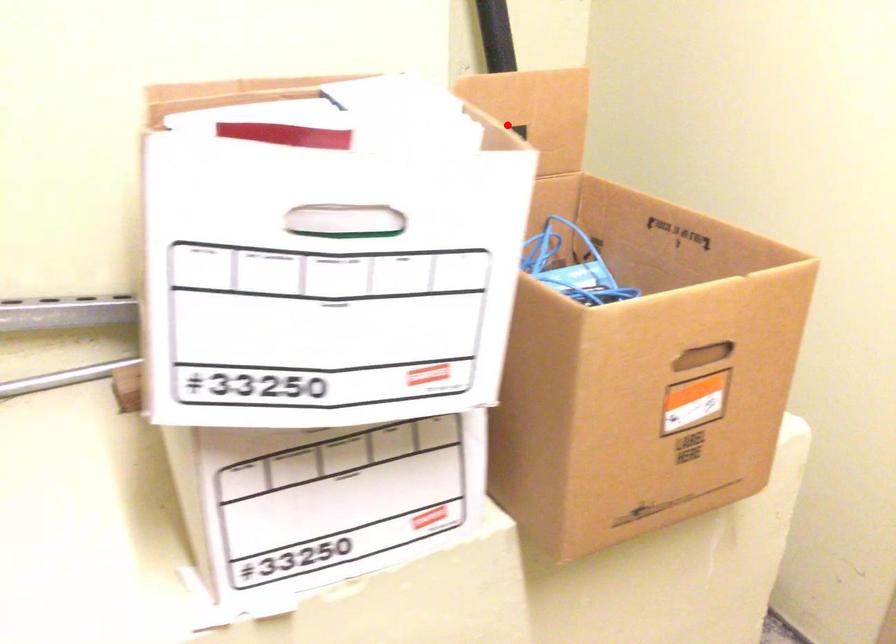
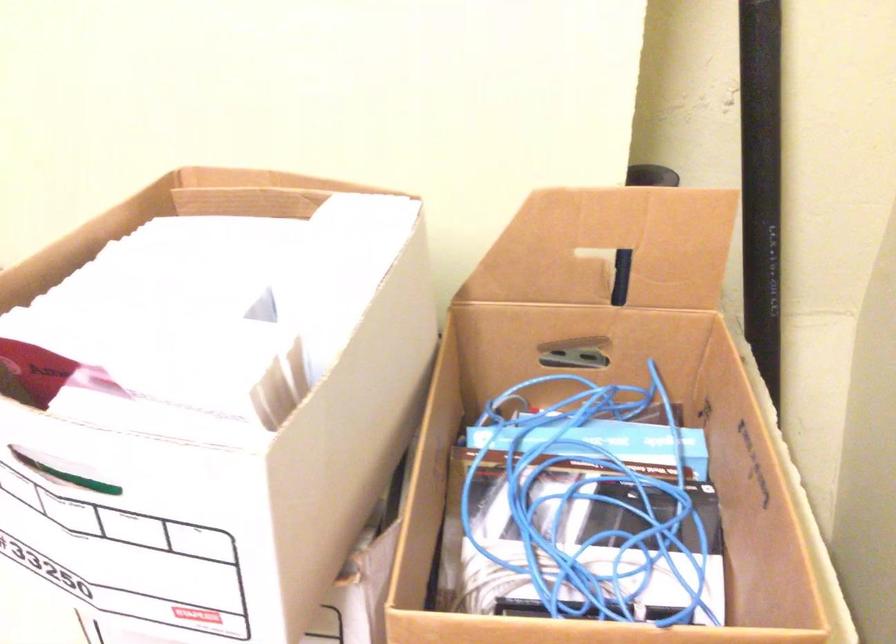
Question: I am providing you with two images of the same scene from different viewpoints. A red point is shown in image1. For the corresponding object point in image2, is it positioned nearer or farther from the camera?

Choices:
 (A) Nearer
 (B) Farther

Answer: (A)